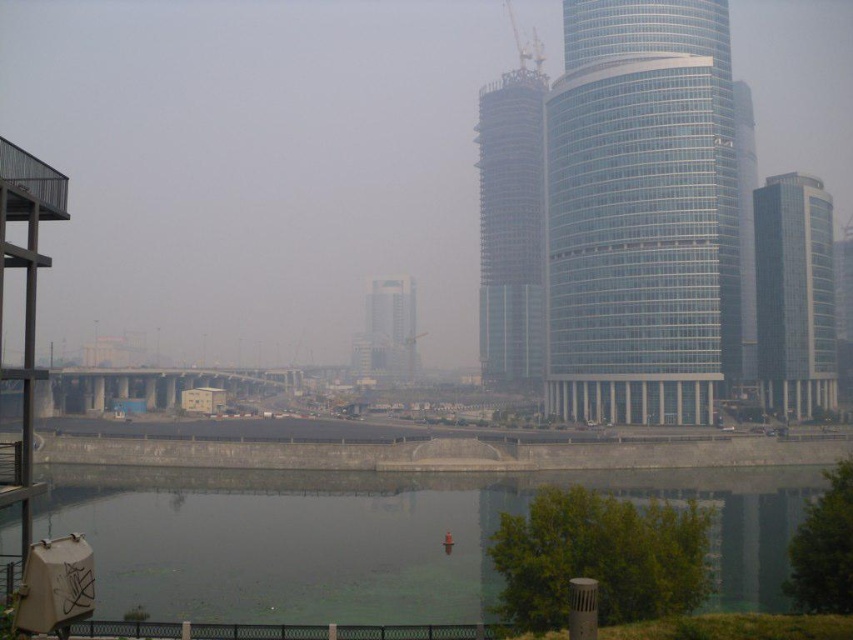
Question: Which point appears farthest from the camera in this image?

Choices:
 (A) (801, 372)
 (B) (380, 312)
 (C) (751, 202)

Answer: (B)

Question: Which object is the farthest from the white glass building at center?

Choices:
 (A) transparent glass skyscraper at right
 (B) dark green water at lower center
 (C) clear glass skyscraper at right

Answer: (B)

Question: Can you confirm if transparent glass tower at center is smaller than clear glass skyscraper at right?

Choices:
 (A) no
 (B) yes

Answer: (A)

Question: Can you confirm if transparent glass tower at center is positioned to the right of clear glass skyscraper at center?

Choices:
 (A) yes
 (B) no

Answer: (A)

Question: Is transparent glass tower at center closer to the viewer compared to white glass building at center?

Choices:
 (A) no
 (B) yes

Answer: (B)

Question: Which object appears farthest from the camera in this image?

Choices:
 (A) clear glass skyscraper at right
 (B) transparent glass skyscraper at right
 (C) white glass building at center

Answer: (C)